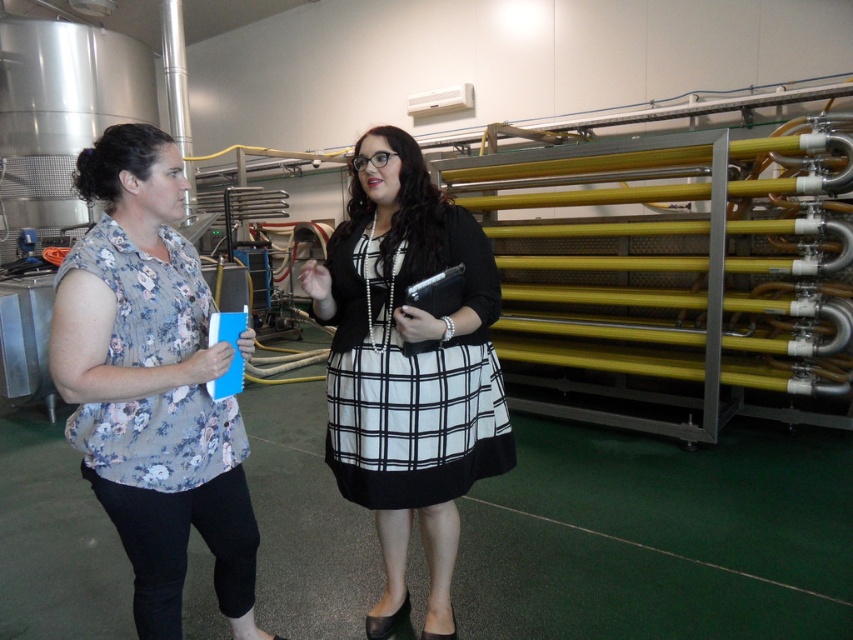
Question: Observing the image, what is the correct spatial positioning of floral fabric blouse at left in reference to matte black dress at center?

Choices:
 (A) right
 (B) left

Answer: (B)

Question: Among these objects, which one is nearest to the camera?

Choices:
 (A) matte black dress at center
 (B) floral fabric blouse at left

Answer: (B)

Question: Is the position of floral fabric blouse at left less distant than that of matte black dress at center?

Choices:
 (A) no
 (B) yes

Answer: (B)

Question: Is floral fabric blouse at left to the left of matte black dress at center from the viewer's perspective?

Choices:
 (A) yes
 (B) no

Answer: (A)